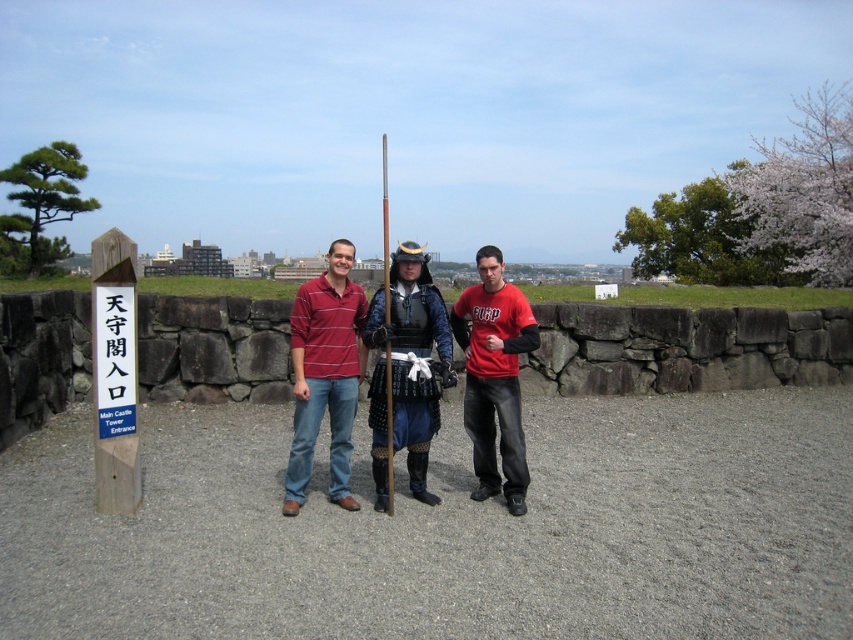
Question: Is matte black armor at center thinner than black textured armor at center?

Choices:
 (A) yes
 (B) no

Answer: (B)

Question: Does red matte shirt at center appear on the left side of black textured armor at center?

Choices:
 (A) yes
 (B) no

Answer: (B)

Question: Can you confirm if matte black armor at center is positioned above black textured armor at center?

Choices:
 (A) no
 (B) yes

Answer: (A)

Question: Among these points, which one is farthest from the camera?

Choices:
 (A) (440, 321)
 (B) (340, 316)
 (C) (488, 387)

Answer: (A)

Question: Which of the following is the farthest from the observer?

Choices:
 (A) (463, 305)
 (B) (425, 307)

Answer: (A)

Question: Which point is closer to the camera?

Choices:
 (A) striped cotton polo shirt at center
 (B) red matte shirt at center
 (C) matte black armor at center

Answer: (C)